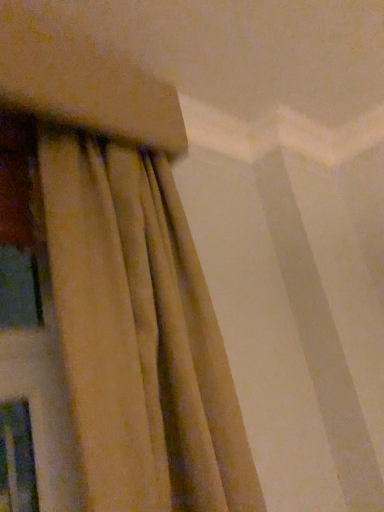
What is the approximate height of textured beige curtain at upper left?

textured beige curtain at upper left is 27.98 inches in height.

What do you see at coordinates (140, 335) in the screenshot?
I see `textured beige curtain at upper left` at bounding box center [140, 335].

The height and width of the screenshot is (512, 384). I want to click on textured beige curtain at upper left, so click(140, 335).

This screenshot has height=512, width=384. In order to click on textured beige curtain at upper left in this screenshot , I will do `click(140, 335)`.